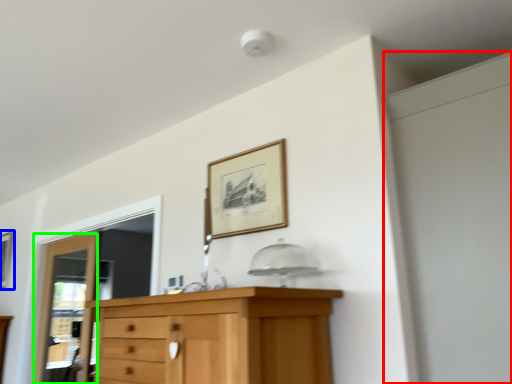
Question: Which object is the closest to the screen door (highlighted by a red box)? Choose among these: picture frame (highlighted by a blue box) or door (highlighted by a green box).

Choices:
 (A) picture frame
 (B) door

Answer: (B)